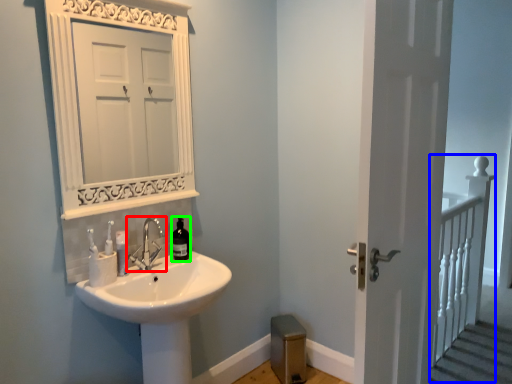
Question: Estimate the real-world distances between objects in this image. Which object is farther from tap (highlighted by a red box), rail (highlighted by a blue box) or bottle (highlighted by a green box)?

Choices:
 (A) rail
 (B) bottle

Answer: (A)